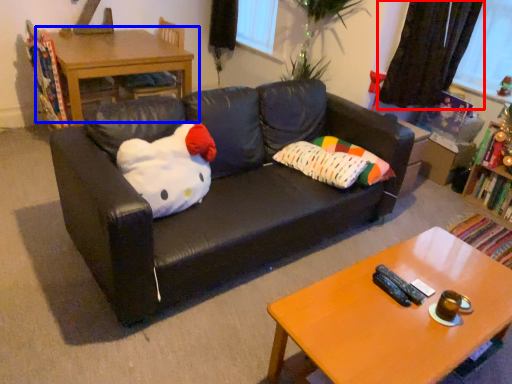
Question: Among these objects, which one is nearest to the camera, curtain (highlighted by a red box) or table (highlighted by a blue box)?

Choices:
 (A) curtain
 (B) table

Answer: (A)